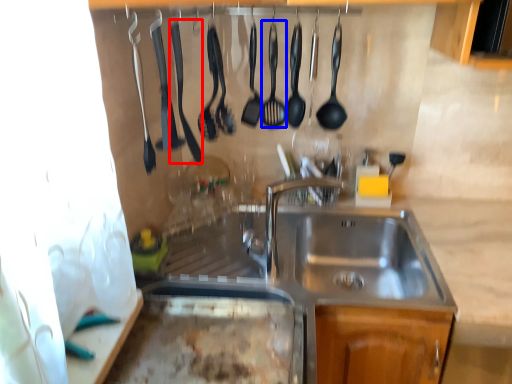
Question: Which point is closer to the camera, silverware (highlighted by a red box) or utensil (highlighted by a blue box)?

Choices:
 (A) silverware
 (B) utensil

Answer: (A)